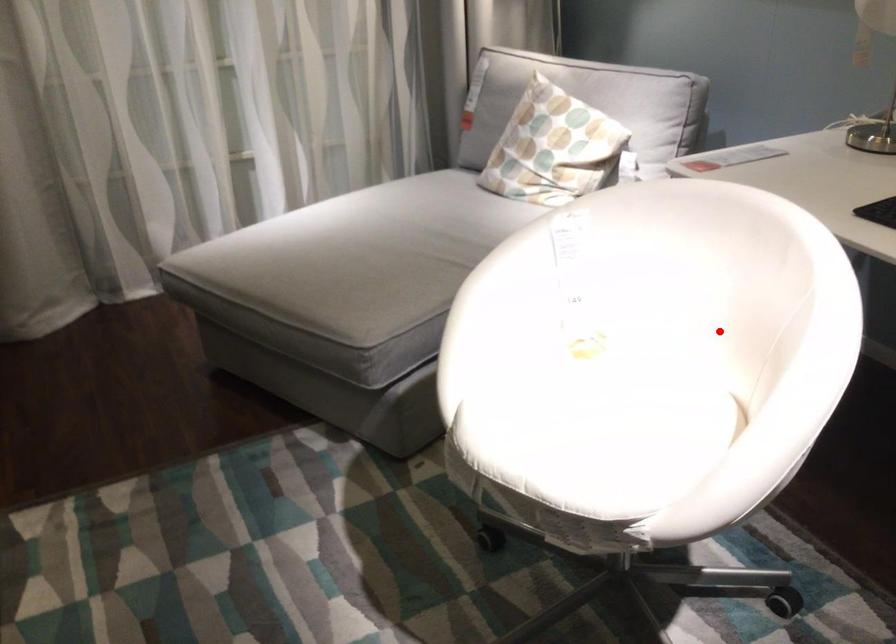
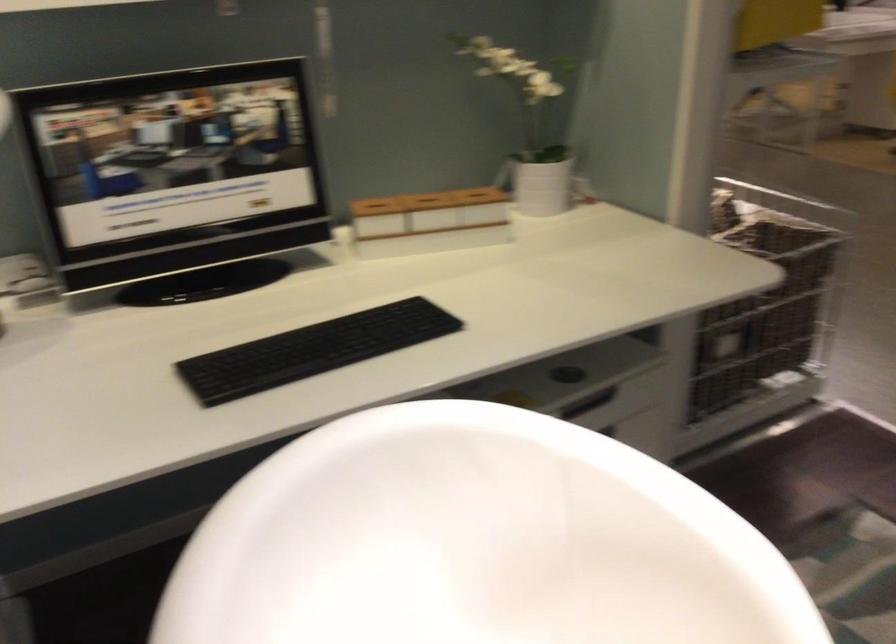
Question: I am providing you with two images of the same scene from different viewpoints. A red point is shown in image1. For the corresponding object point in image2, is it positioned nearer or farther from the camera?

Choices:
 (A) Nearer
 (B) Farther

Answer: (A)